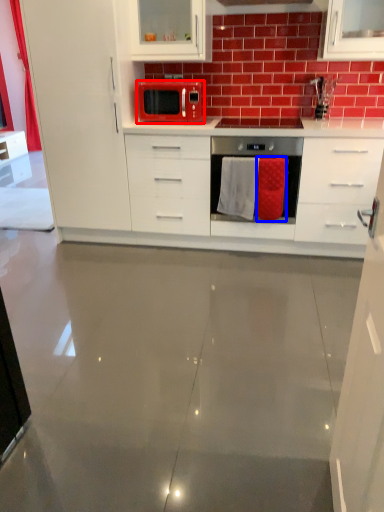
Question: Which point is further to the camera, kitchen appliance (highlighted by a red box) or cloth (highlighted by a blue box)?

Choices:
 (A) kitchen appliance
 (B) cloth

Answer: (A)